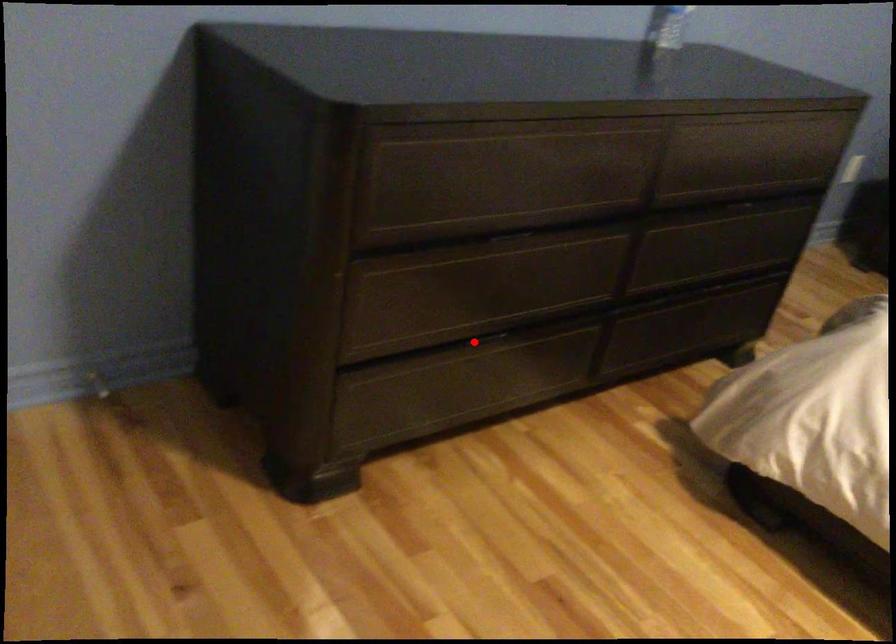
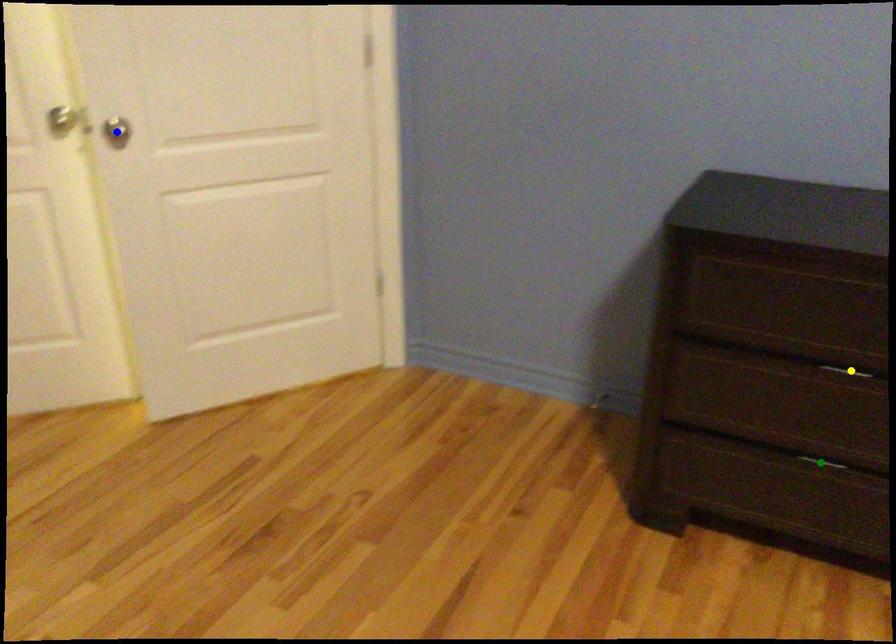
Question: I am providing you with two images of the same scene from different viewpoints. A red point is marked on the first image. You are given multiple points on the second image. Which point in image 2 represents the same 3d spot as the red point in image 1?

Choices:
 (A) yellow point
 (B) green point
 (C) blue point

Answer: (B)